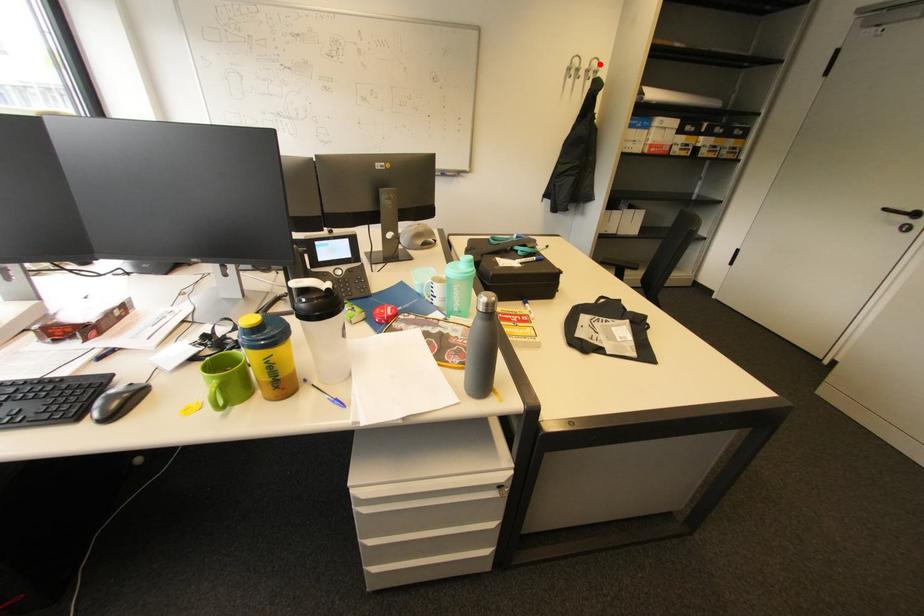
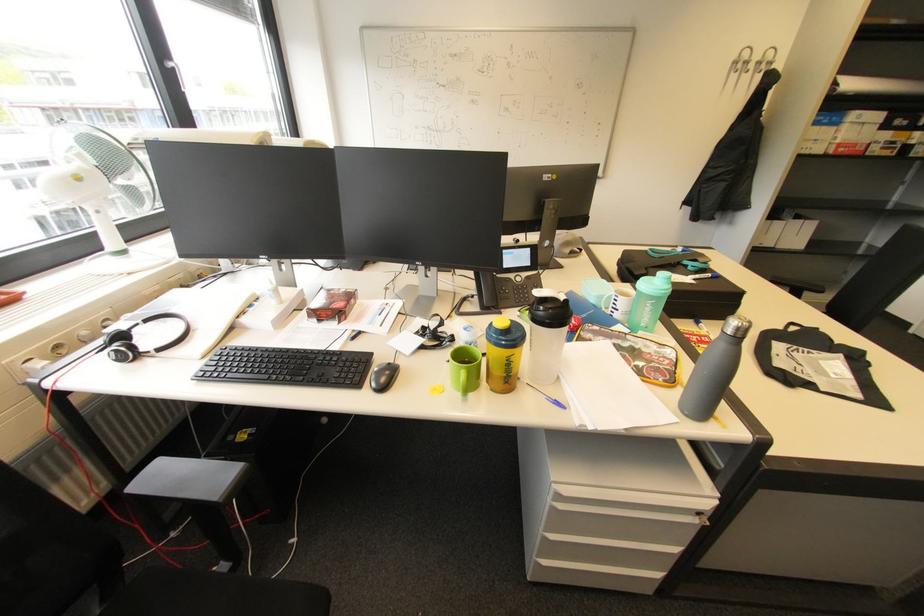
Question: I am providing you with two images of the same scene from different viewpoints. Given a red point in image1, look at the same physical point in image2. Is it:

Choices:
 (A) Closer to the viewpoint
 (B) Farther from the viewpoint

Answer: (B)